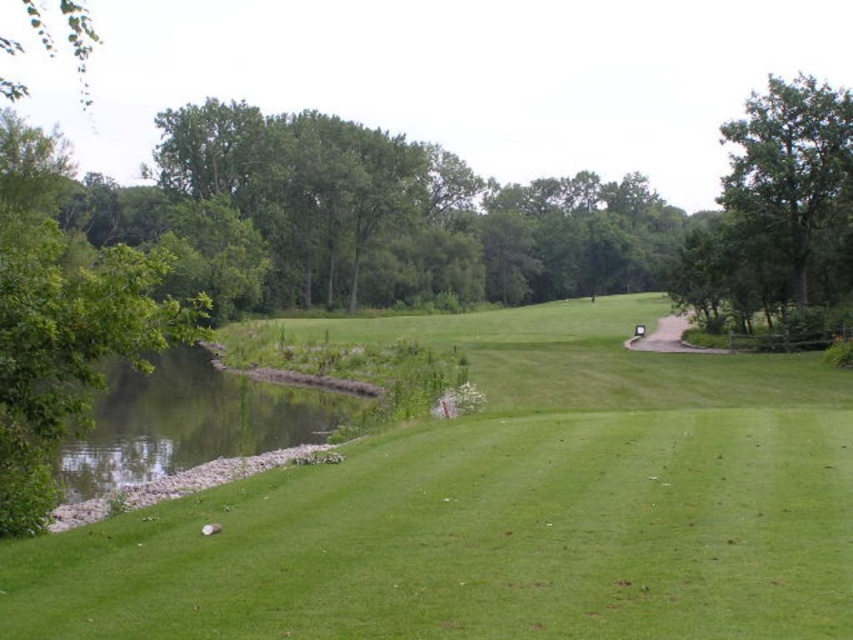
Is point (682, 576) farther from camera compared to point (814, 129)?

No.

What are the coordinates of `green grassy golf course at center` in the screenshot? It's located at (503, 508).

Where is `green leafy tree at upper right`? This screenshot has height=640, width=853. green leafy tree at upper right is located at coordinates (788, 163).

Which is more to the left, green leafy tree at upper right or green leafy tree at upper left?

green leafy tree at upper left is more to the left.

Measure the distance between point (795,166) and camera.

Point (795,166) and camera are 142.82 feet apart from each other.

Find the location of a particular element. Image resolution: width=853 pixels, height=640 pixels. green leafy tree at upper right is located at coordinates click(788, 163).

Looking at this image, can you confirm if green grassy golf course at center is positioned to the right of green leafy tree at upper left?

Indeed, green grassy golf course at center is positioned on the right side of green leafy tree at upper left.

Where is `green grassy golf course at center`? green grassy golf course at center is located at coordinates (503, 508).